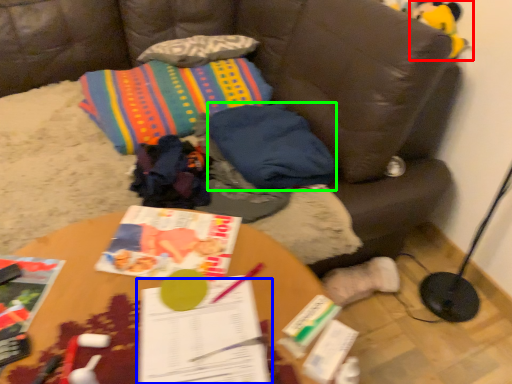
Question: Based on their relative distances, which object is nearer to toy (highlighted by a red box)? Choose from book (highlighted by a blue box) and pillow (highlighted by a green box).

Choices:
 (A) book
 (B) pillow

Answer: (B)